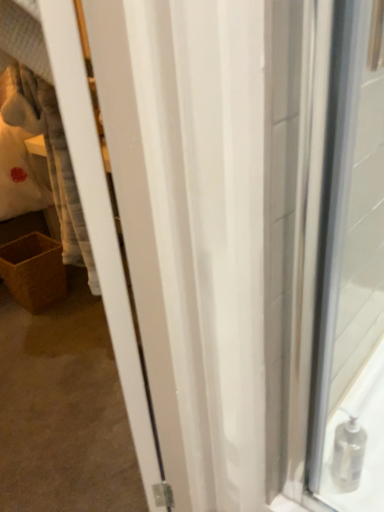
This screenshot has width=384, height=512. I want to click on free space in front of brown woven basket at lower left, so click(39, 329).